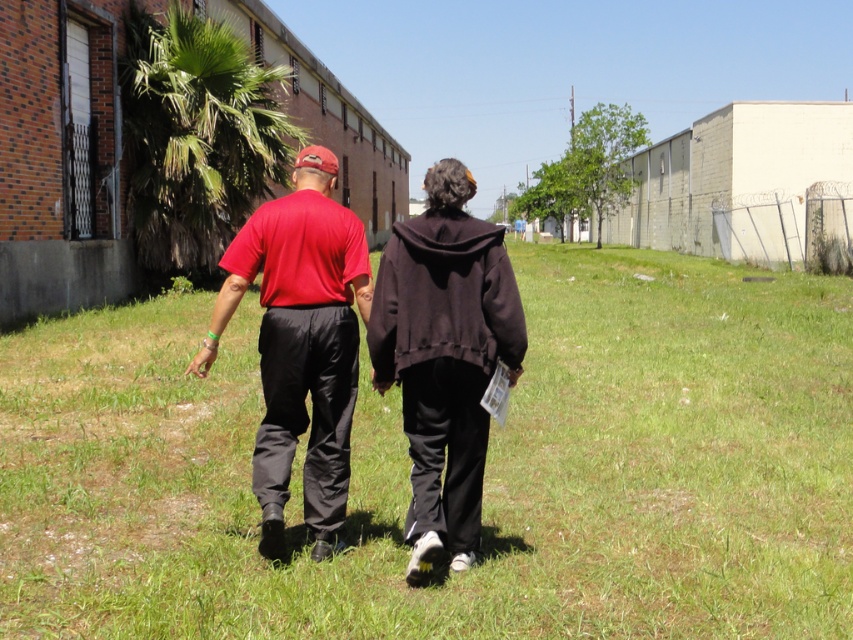
Question: Can you confirm if green grass at center is smaller than matte red shirt at center?

Choices:
 (A) no
 (B) yes

Answer: (A)

Question: Among these points, which one is nearest to the camera?

Choices:
 (A) (312, 225)
 (B) (328, 561)

Answer: (B)

Question: Among these points, which one is farthest from the camera?

Choices:
 (A) (350, 372)
 (B) (47, 570)

Answer: (A)

Question: Which point is closer to the camera?

Choices:
 (A) (312, 246)
 (B) (428, 412)

Answer: (B)

Question: Does green grass at center appear on the left side of matte red shirt at center?

Choices:
 (A) yes
 (B) no

Answer: (B)

Question: Does black matte hoodie at center lie behind matte red shirt at center?

Choices:
 (A) yes
 (B) no

Answer: (B)